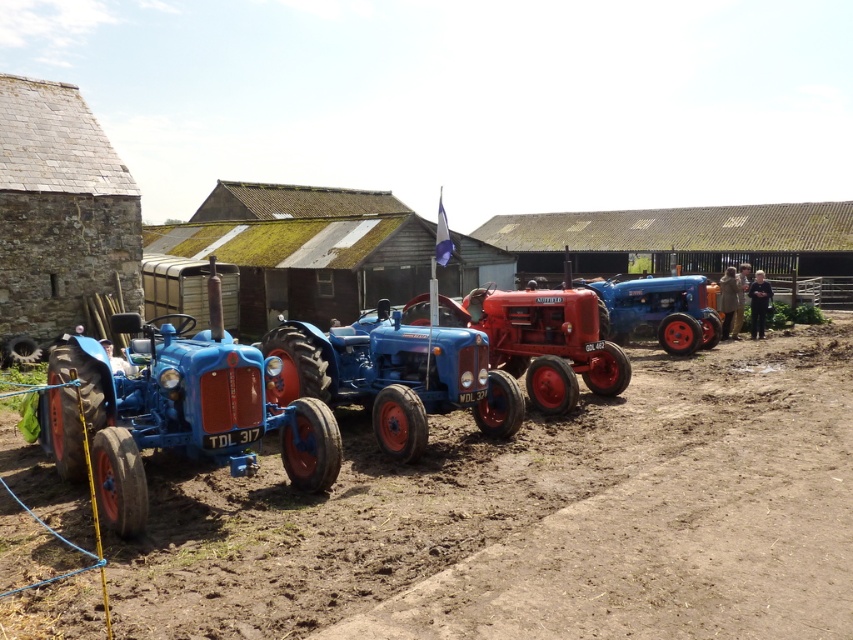
Is point (753, 554) more distant than point (102, 436)?

No, (753, 554) is closer to viewer.

Does brown soil at lower center lie in front of matte blue tractor at left?

Yes.

Is point (445, 461) more distant than point (300, 404)?

Yes, point (445, 461) is farther from viewer.

This screenshot has width=853, height=640. Find the location of `brown soil at lower center`. brown soil at lower center is located at coordinates (535, 516).

Which is above, brown soil at lower center or matte blue tractor at center?

matte blue tractor at center

Who is positioned more to the left, brown soil at lower center or matte blue tractor at center?

From the viewer's perspective, matte blue tractor at center appears more on the left side.

Image resolution: width=853 pixels, height=640 pixels. Describe the element at coordinates (535, 516) in the screenshot. I see `brown soil at lower center` at that location.

At what (x,y) coordinates should I click in order to perform the action: click on brown soil at lower center. Please return your answer as a coordinate pair (x, y). Image resolution: width=853 pixels, height=640 pixels. Looking at the image, I should click on 535,516.

Does brown soil at lower center lie behind red matte tractor at center?

No, it is in front of red matte tractor at center.

Can you confirm if brown soil at lower center is wider than red matte tractor at center?

Yes.

Is point (735, 480) positioned in front of point (538, 369)?

That is True.

Locate an element on the screen. The height and width of the screenshot is (640, 853). brown soil at lower center is located at coordinates (535, 516).